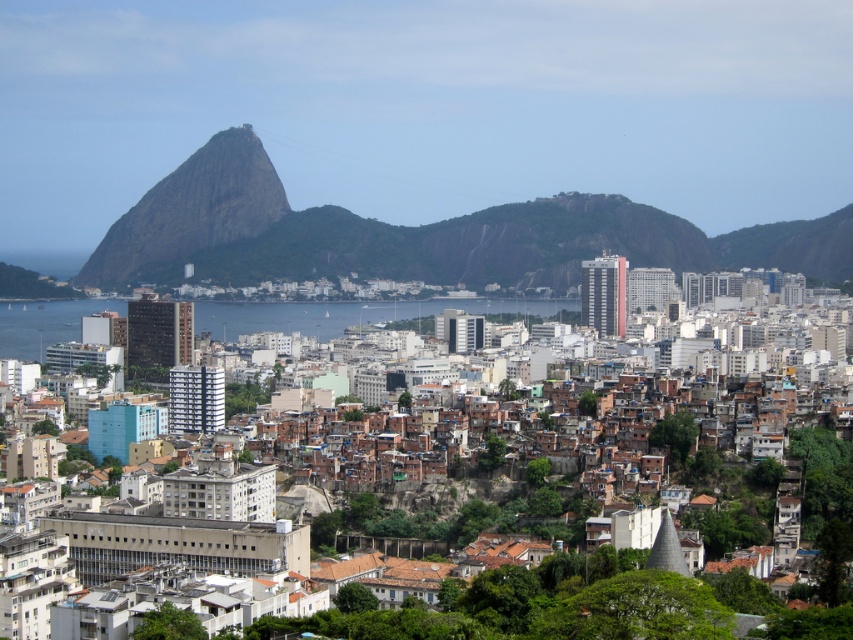
Question: Which of the following is the farthest from the observer?

Choices:
 (A) rustic granite mountain at center
 (B) clear blue water at center
 (C) brown rock formation at upper left

Answer: (C)

Question: Is rustic granite mountain at center positioned in front of brown rock formation at upper left?

Choices:
 (A) yes
 (B) no

Answer: (A)

Question: Which point appears farthest from the camera in this image?

Choices:
 (A) (x=421, y=317)
 (B) (x=199, y=170)
 (C) (x=144, y=264)

Answer: (C)

Question: Considering the real-world distances, which object is closest to the clear blue water at center?

Choices:
 (A) rustic granite mountain at center
 (B) brown rock formation at upper left

Answer: (A)

Question: Where is rustic granite mountain at center located in relation to clear blue water at center in the image?

Choices:
 (A) right
 (B) left

Answer: (A)

Question: Can you confirm if brown rock formation at upper left is positioned below clear blue water at center?

Choices:
 (A) no
 (B) yes

Answer: (A)